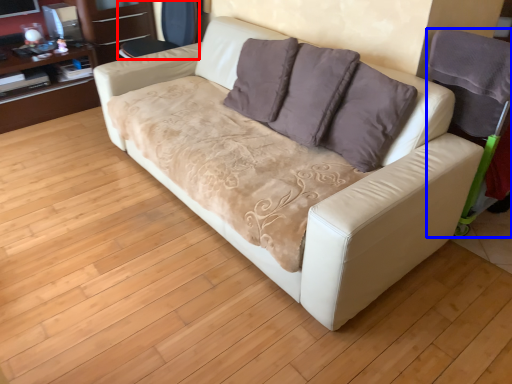
Question: Which point is closer to the camera, armchair (highlighted by a red box) or armchair (highlighted by a blue box)?

Choices:
 (A) armchair
 (B) armchair

Answer: (B)